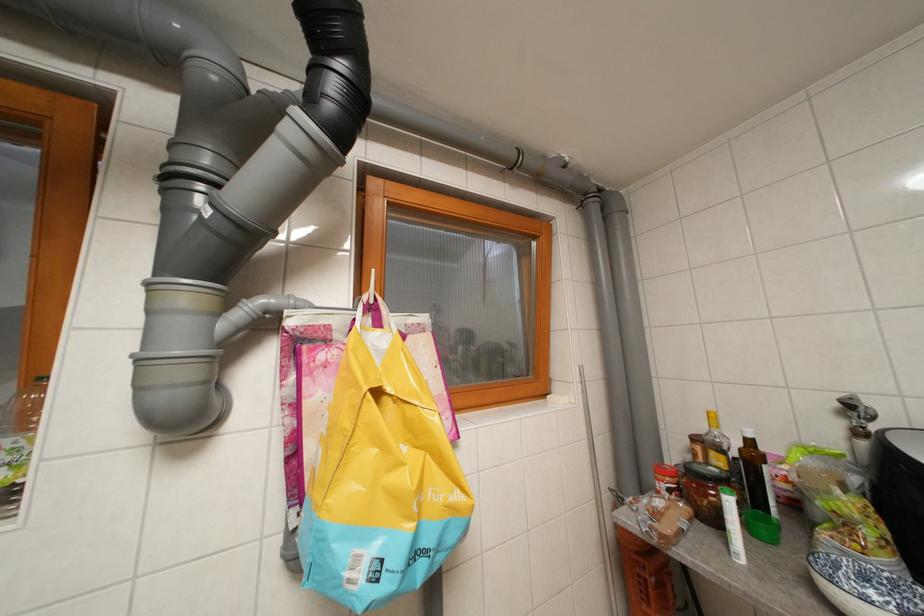
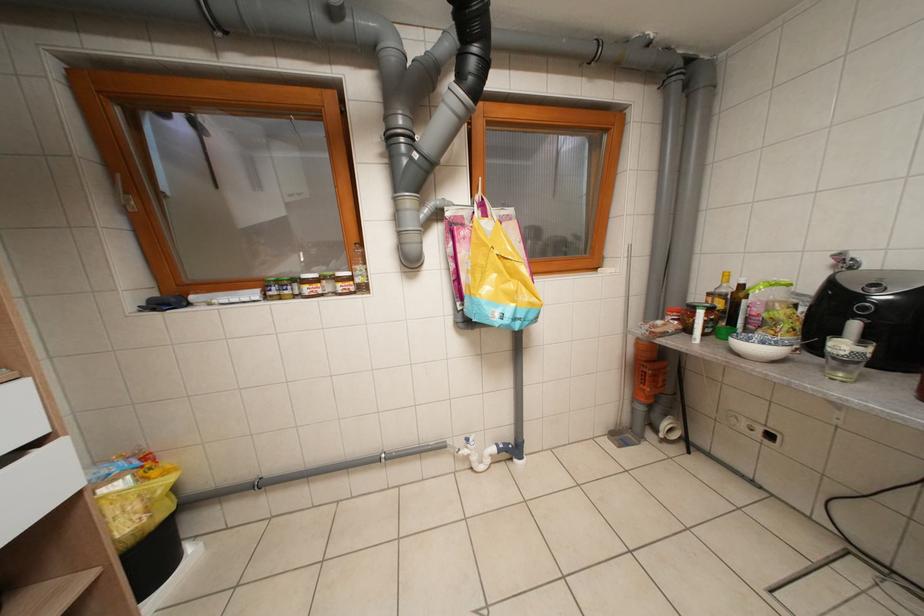
Question: In a continuous first-person perspective shot, in which direction is the camera moving?

Choices:
 (A) Left
 (B) Right
 (C) Forward
 (D) Backward

Answer: (D)